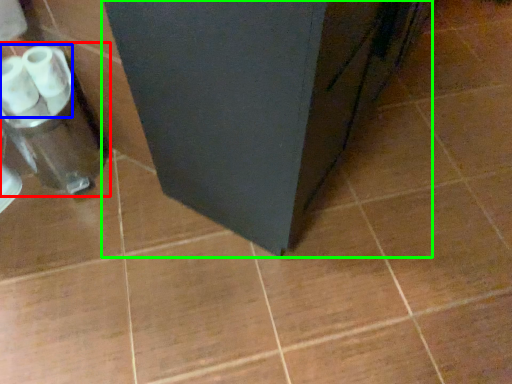
Question: Estimate the real-world distances between objects in this image. Which object is closer to blender (highlighted by a red box), toilet paper (highlighted by a blue box) or furniture (highlighted by a green box)?

Choices:
 (A) toilet paper
 (B) furniture

Answer: (A)